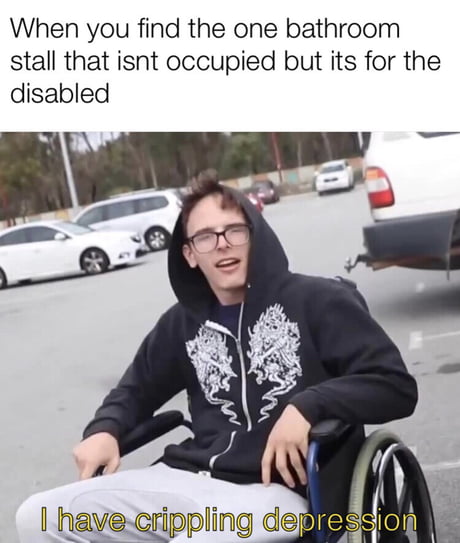
Where is `bar`? Image resolution: width=460 pixels, height=543 pixels. bar is located at coordinates pyautogui.click(x=315, y=460).